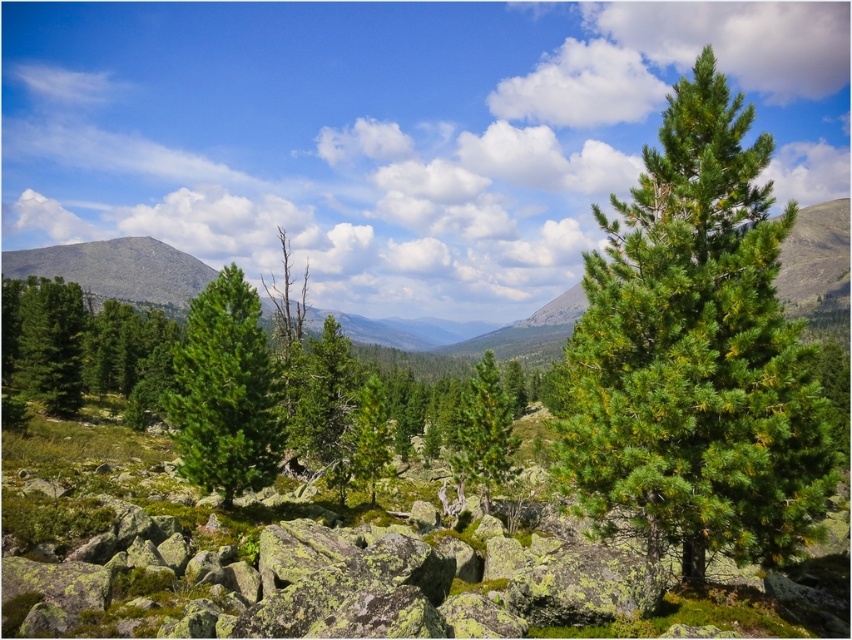
Question: Estimate the real-world distances between objects in this image. Which object is farther from the green matte tree at center?

Choices:
 (A) green needle-like tree at center
 (B) green matte tree at left

Answer: (A)

Question: Does green needle-like tree at center-right have a greater width compared to green matte tree at left?

Choices:
 (A) no
 (B) yes

Answer: (A)

Question: Does green matte tree at center have a greater width compared to green matte tree at left?

Choices:
 (A) no
 (B) yes

Answer: (A)

Question: Which object is the closest to the green needle-like tree at center-right?

Choices:
 (A) green matte tree at center
 (B) green matte tree at left

Answer: (A)

Question: Which of the following is the closest to the observer?

Choices:
 (A) (227, 467)
 (B) (464, 429)
 (C) (611, 332)

Answer: (C)

Question: In this image, where is green matte tree at center located relative to green needle-like tree at center?

Choices:
 (A) below
 (B) above

Answer: (B)